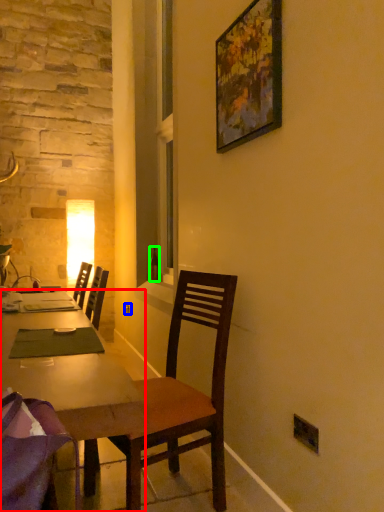
Question: Which is nearer to the desk (highlighted by a red box)? power outlet (highlighted by a blue box) or bottle (highlighted by a green box).

Choices:
 (A) power outlet
 (B) bottle

Answer: (B)